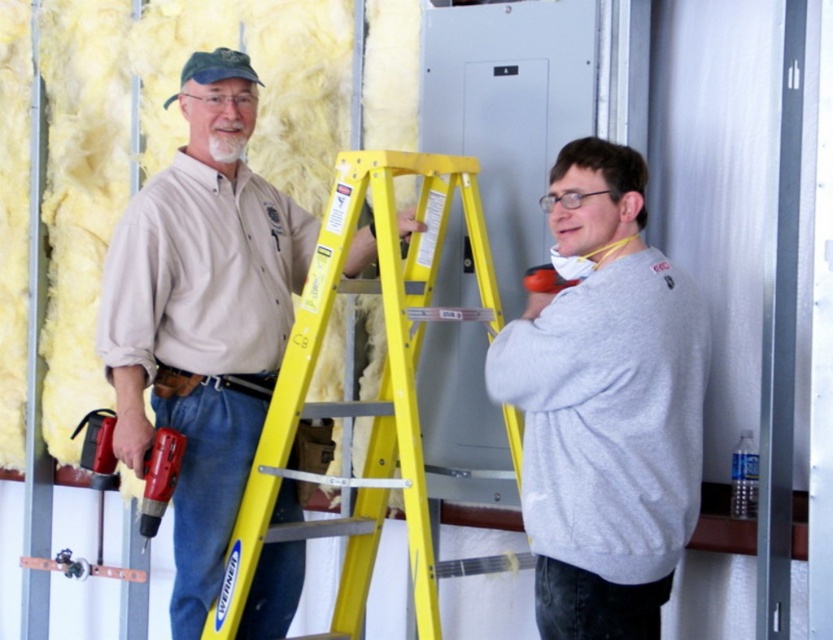
Question: Is gray cotton sweatshirt at right to the left of orange rubber drill at center from the viewer's perspective?

Choices:
 (A) yes
 (B) no

Answer: (B)

Question: Does matte khaki shirt at center appear under red plastic drill at lower left?

Choices:
 (A) yes
 (B) no

Answer: (B)

Question: Which object is positioned farthest from the orange rubber drill at center?

Choices:
 (A) red plastic drill at lower left
 (B) gray cotton sweatshirt at right

Answer: (A)

Question: Can you confirm if matte khaki shirt at center is positioned to the right of orange rubber drill at center?

Choices:
 (A) no
 (B) yes

Answer: (A)

Question: Which point is closer to the camera?

Choices:
 (A) orange rubber drill at center
 (B) red plastic drill at lower left
 (C) matte khaki shirt at center
 (D) yellow/yellowish metal ladder at center

Answer: (D)

Question: Which point appears farthest from the camera in this image?

Choices:
 (A) (535, 276)
 (B) (570, 451)
 (C) (243, 545)

Answer: (C)